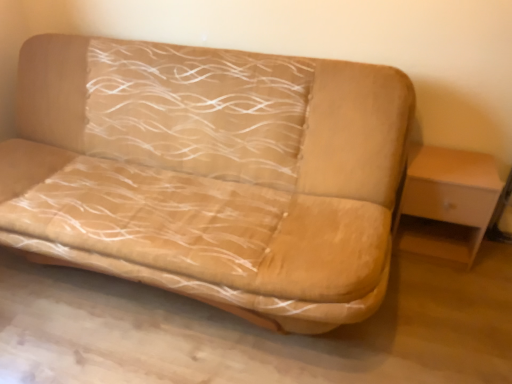
Image resolution: width=512 pixels, height=384 pixels. In order to click on vacant space in front of light wood/wooden table at right in this screenshot , I will do `click(447, 292)`.